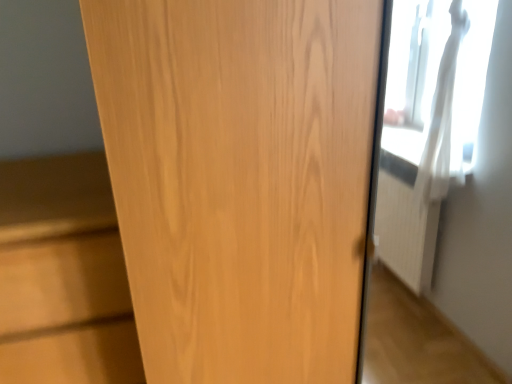
Question: From the image's perspective, is wooden door at center located above or below light wood cabinet at left?

Choices:
 (A) below
 (B) above

Answer: (B)

Question: From a real-world perspective, is wooden door at center positioned above or below light wood cabinet at left?

Choices:
 (A) below
 (B) above

Answer: (B)

Question: Based on their positions, is wooden door at center located to the left or right of light wood cabinet at left?

Choices:
 (A) left
 (B) right

Answer: (B)

Question: Choose the correct answer: Is light wood cabinet at left inside wooden door at center or outside it?

Choices:
 (A) inside
 (B) outside

Answer: (B)

Question: In terms of height, does light wood cabinet at left look taller or shorter compared to wooden door at center?

Choices:
 (A) tall
 (B) short

Answer: (B)

Question: Does point (3, 188) appear closer or farther from the camera than point (333, 294)?

Choices:
 (A) farther
 (B) closer

Answer: (A)

Question: In the image, is light wood cabinet at left positioned in front of or behind wooden door at center?

Choices:
 (A) front
 (B) behind

Answer: (B)